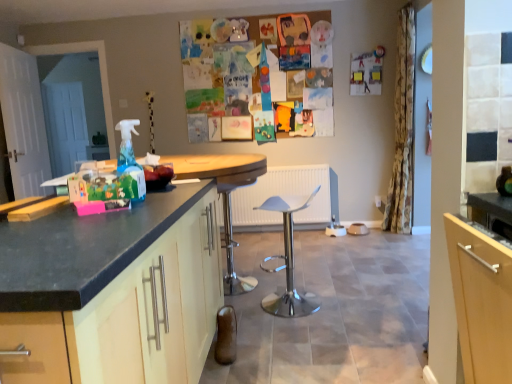
Question: Is floral fabric curtain at right located within matte wood cabinet at left?

Choices:
 (A) no
 (B) yes

Answer: (A)

Question: Can you see matte wood cabinet at left touching floral fabric curtain at right?

Choices:
 (A) yes
 (B) no

Answer: (B)

Question: Is matte wood cabinet at left shorter than floral fabric curtain at right?

Choices:
 (A) no
 (B) yes

Answer: (B)

Question: Does matte wood cabinet at left have a greater height compared to floral fabric curtain at right?

Choices:
 (A) yes
 (B) no

Answer: (B)

Question: Can you confirm if matte wood cabinet at left is positioned to the right of floral fabric curtain at right?

Choices:
 (A) no
 (B) yes

Answer: (A)

Question: Can you confirm if matte wood cabinet at left is positioned to the left of floral fabric curtain at right?

Choices:
 (A) no
 (B) yes

Answer: (B)

Question: Is floral fabric curtain at right not inside matte wood cabinet at left?

Choices:
 (A) no
 (B) yes

Answer: (B)

Question: Is floral fabric curtain at right at the right side of matte wood cabinet at left?

Choices:
 (A) yes
 (B) no

Answer: (A)

Question: Does floral fabric curtain at right appear on the left side of matte wood cabinet at left?

Choices:
 (A) yes
 (B) no

Answer: (B)

Question: From the image's perspective, is floral fabric curtain at right above matte wood cabinet at left?

Choices:
 (A) yes
 (B) no

Answer: (A)

Question: Is floral fabric curtain at right touching matte wood cabinet at left?

Choices:
 (A) yes
 (B) no

Answer: (B)

Question: Does floral fabric curtain at right have a smaller size compared to matte wood cabinet at left?

Choices:
 (A) yes
 (B) no

Answer: (A)

Question: Can you confirm if matte wood cabinet at left is taller than white glossy swivel chair at center?

Choices:
 (A) yes
 (B) no

Answer: (A)